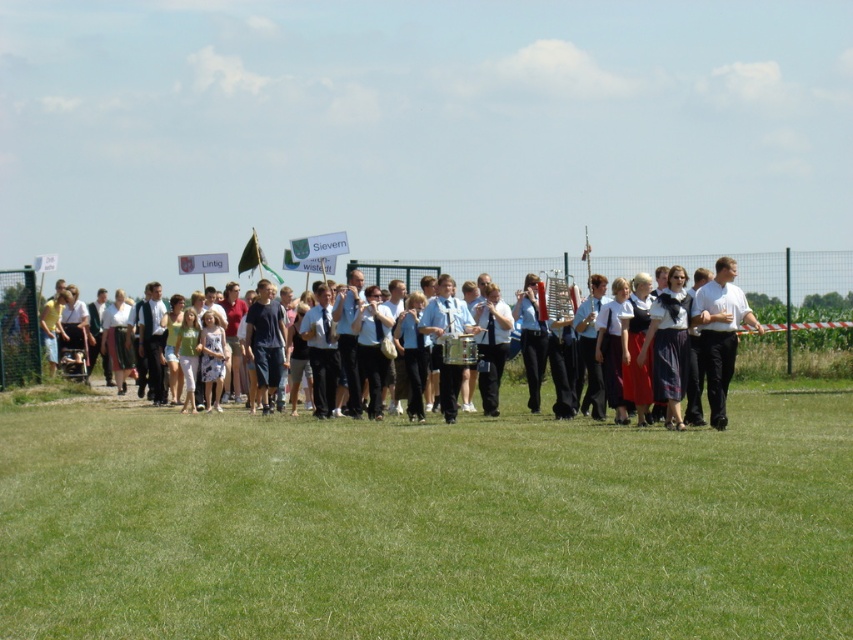
Question: Estimate the real-world distances between objects in this image. Which object is closer to the white matte shirt at center?

Choices:
 (A) light blue fabric dress at center
 (B) green grass at center

Answer: (A)

Question: Is green grass at center above white matte shirt at center?

Choices:
 (A) yes
 (B) no

Answer: (B)

Question: Which of these objects is positioned closest to the white matte shirt at center?

Choices:
 (A) light blue fabric dress at center
 (B) green grass at center

Answer: (A)

Question: Observing the image, what is the correct spatial positioning of light blue fabric dress at center in reference to white matte shirt at center?

Choices:
 (A) left
 (B) right

Answer: (A)

Question: Is green grass at center to the left of light blue fabric dress at center from the viewer's perspective?

Choices:
 (A) no
 (B) yes

Answer: (B)

Question: Which point is farther to the camera?

Choices:
 (A) (407, 634)
 (B) (722, 314)
 (C) (705, 364)

Answer: (C)